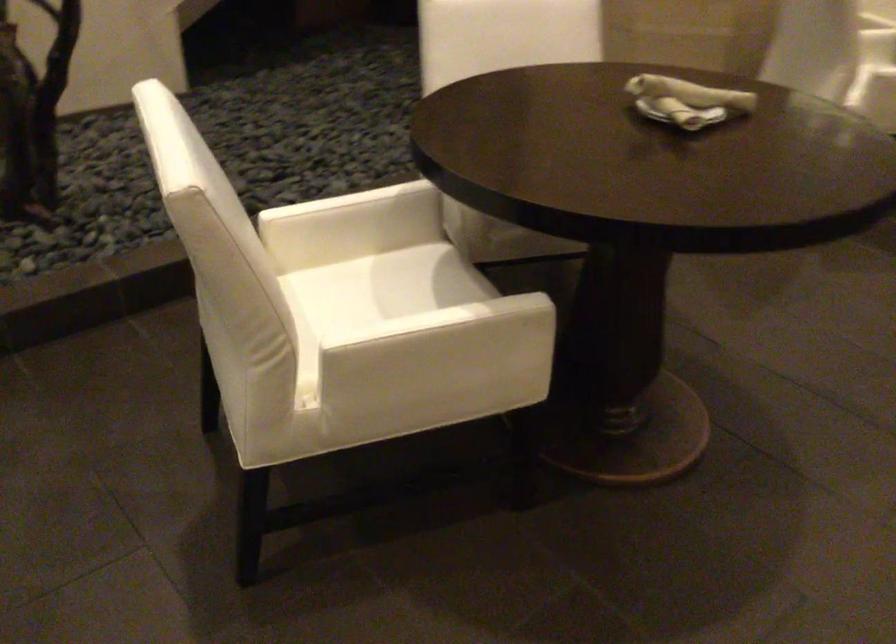
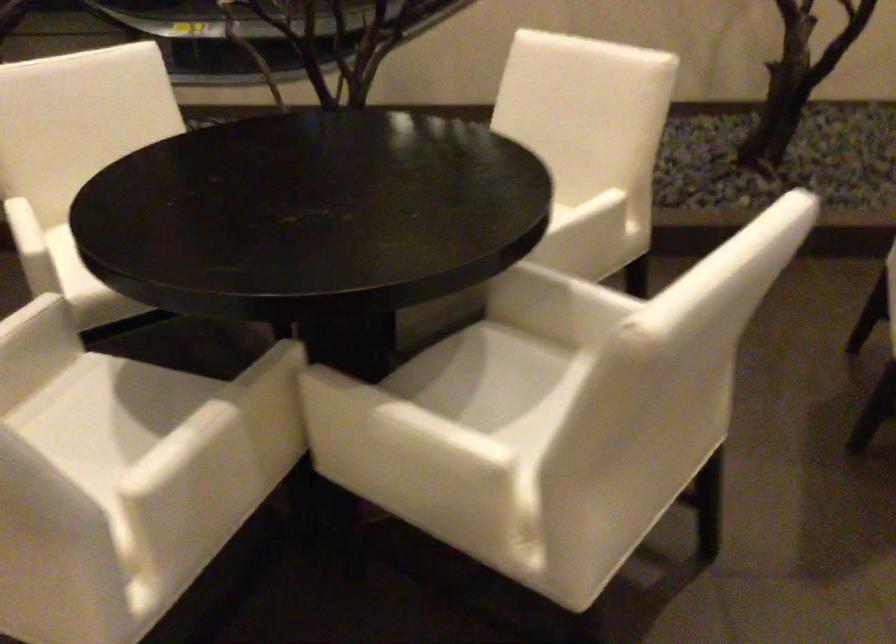
Question: How did the camera likely rotate?

Choices:
 (A) Left
 (B) Right
 (C) Up
 (D) Down

Answer: (A)